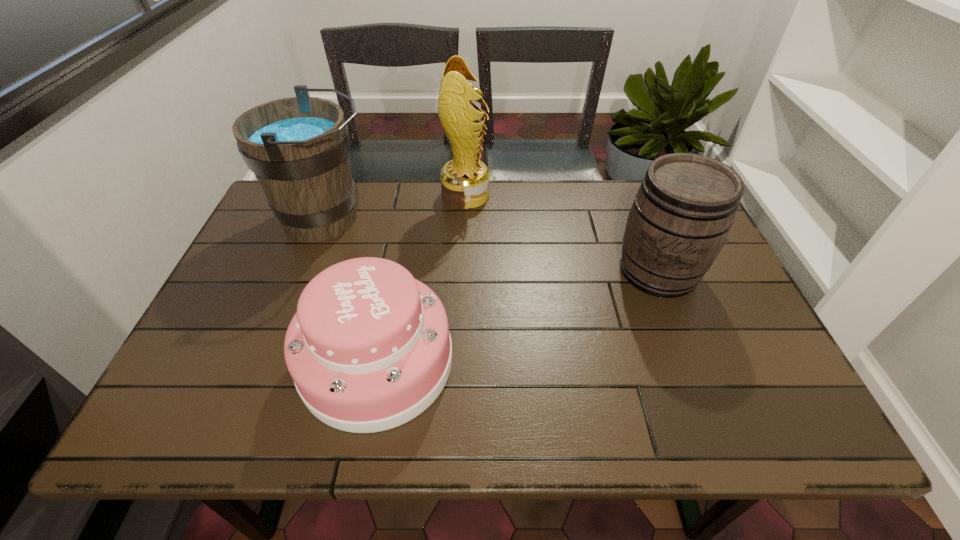
Find the location of a particular element. vacant space that's between the left wine bucket and the right wine bucket is located at coordinates (492, 245).

Identify the location of vacant space that's between the cake and the tallest object. (421, 278).

The image size is (960, 540). In order to click on vacant point located between the rightmost object and the left wine bucket in this screenshot , I will do `click(492, 245)`.

Locate an element on the screen. free space between the tallest object and the left wine bucket is located at coordinates pos(396,207).

You are a GUI agent. You are given a task and a screenshot of the screen. Output one action in this format:
    pyautogui.click(x=<x>, y=<y>)
    Task: Click on the free space between the third tallest object and the award
    This screenshot has height=540, width=960.
    Given the screenshot: What is the action you would take?
    pyautogui.click(x=562, y=233)

At what (x,y) coordinates should I click in order to perform the action: click on vacant space in between the shortest object and the rightmost object. Please return your answer as a coordinate pair (x, y). This screenshot has width=960, height=540. Looking at the image, I should click on (517, 316).

The width and height of the screenshot is (960, 540). I want to click on free point between the right wine bucket and the tallest object, so click(x=562, y=233).

Identify the location of unoccupied position between the shorter wine bucket and the left wine bucket. This screenshot has height=540, width=960. (492, 245).

Choose which object is the nearest neighbor to the tallest object. Please provide its 2D coordinates. Your answer should be formatted as a tuple, i.e. [(x, y)], where the tuple contains the x and y coordinates of a point satisfying the conditions above.

[(298, 147)]

Locate an element on the screen. The width and height of the screenshot is (960, 540). object that is the third nearest to the left wine bucket is located at coordinates (680, 218).